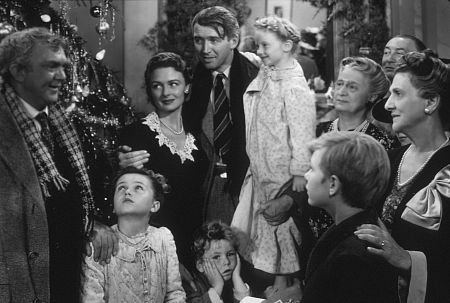
Identify the location of back wall. The height and width of the screenshot is (303, 450). (138, 22).